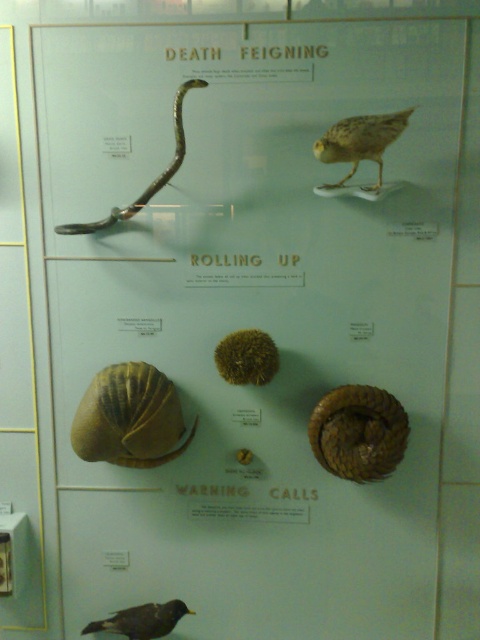
Question: Can you confirm if brown scaly snail at center is positioned to the left of black feathered bird at lower left?

Choices:
 (A) yes
 (B) no

Answer: (B)

Question: Among these objects, which one is nearest to the camera?

Choices:
 (A) black feathered bird at lower left
 (B) yellow matte snail at lower left
 (C) shiny silver snail at upper left
 (D) speckled feathered bird at upper center

Answer: (D)

Question: Can you confirm if speckled feathered bird at upper center is positioned to the right of shiny silver snail at upper left?

Choices:
 (A) yes
 (B) no

Answer: (A)

Question: Among these points, which one is farthest from the camera?

Choices:
 (A) (170, 612)
 (B) (379, 160)
 (C) (391, 394)

Answer: (A)

Question: Among these points, which one is farthest from the camera?

Choices:
 (A) (140, 464)
 (B) (346, 179)
 (C) (354, 442)

Answer: (A)

Question: Is yellow matte snail at lower left wider than brown scaly snail at center?

Choices:
 (A) no
 (B) yes

Answer: (B)